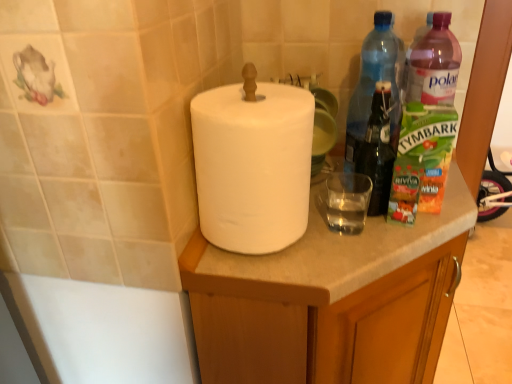
This screenshot has height=384, width=512. Identify the location of free location in front of transparent glass at center. (351, 260).